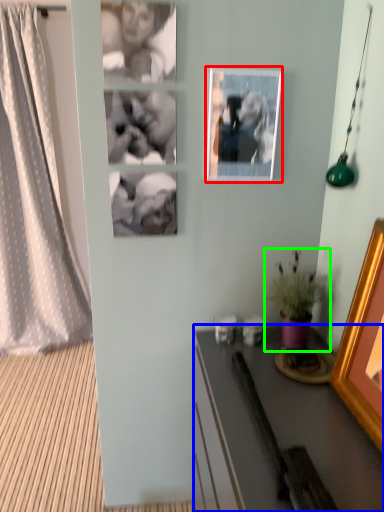
Question: Which object is positioned closest to picture frame (highlighted by a red box)? Select from desk (highlighted by a blue box) and houseplant (highlighted by a green box).

Choices:
 (A) desk
 (B) houseplant

Answer: (B)